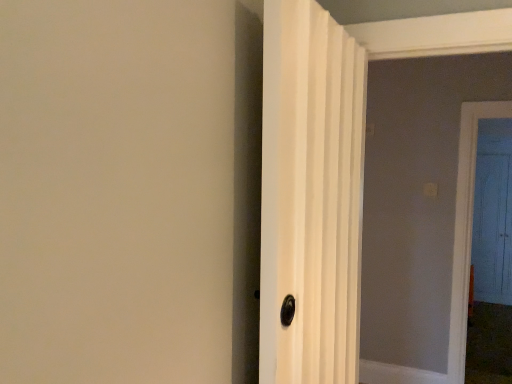
The width and height of the screenshot is (512, 384). What do you see at coordinates (311, 194) in the screenshot?
I see `white textured door at center, which ranks as the first door in left-to-right order` at bounding box center [311, 194].

Identify the location of white textured door at center, which ranks as the first door in left-to-right order. The height and width of the screenshot is (384, 512). (311, 194).

Identify the location of blue wooden door at right, which is the second door in front-to-back order. This screenshot has height=384, width=512. (493, 213).

What do you see at coordinates (493, 213) in the screenshot? I see `blue wooden door at right, marked as the first door in a back-to-front arrangement` at bounding box center [493, 213].

The width and height of the screenshot is (512, 384). What are the coordinates of `white textured door at center, which ranks as the first door in left-to-right order` in the screenshot? It's located at (311, 194).

Which object is positioned more to the left, blue wooden door at right, marked as the first door in a back-to-front arrangement, or white textured door at center, which is the second door from back to front?

white textured door at center, which is the second door from back to front, is more to the left.

Which object is closer to the camera taking this photo, blue wooden door at right, marked as the first door in a back-to-front arrangement, or white textured door at center, positioned as the 2th door in right-to-left order?

white textured door at center, positioned as the 2th door in right-to-left order, is closer to the camera.

Which is more distant, (508,250) or (323,270)?

The point (508,250) is farther from the camera.

From the image's perspective, is blue wooden door at right, which is counted as the 1th door, starting from the right, below white textured door at center, positioned as the 2th door in right-to-left order?

Yes.

From a real-world perspective, relative to white textured door at center, which is the second door from back to front, is blue wooden door at right, acting as the 2th door starting from the left, vertically above or below?

blue wooden door at right, acting as the 2th door starting from the left, is below white textured door at center, which is the second door from back to front.

Does blue wooden door at right, marked as the first door in a back-to-front arrangement, have a lesser width compared to white textured door at center, positioned as the 2th door in right-to-left order?

Correct, the width of blue wooden door at right, marked as the first door in a back-to-front arrangement, is less than that of white textured door at center, positioned as the 2th door in right-to-left order.

Is blue wooden door at right, which is counted as the 1th door, starting from the right, shorter than white textured door at center, which ranks as the first door in left-to-right order?

Incorrect, the height of blue wooden door at right, which is counted as the 1th door, starting from the right, does not fall short of that of white textured door at center, which ranks as the first door in left-to-right order.

Considering the relative sizes of blue wooden door at right, acting as the 2th door starting from the left, and white textured door at center, which is the second door from back to front, in the image provided, is blue wooden door at right, acting as the 2th door starting from the left, smaller than white textured door at center, which is the second door from back to front,?

Correct, blue wooden door at right, acting as the 2th door starting from the left, occupies less space than white textured door at center, which is the second door from back to front.

Is blue wooden door at right, which is counted as the 1th door, starting from the right, not within white textured door at center, positioned as the 2th door in right-to-left order?

Yes.

Is blue wooden door at right, which is counted as the 1th door, starting from the right, next to white textured door at center, positioned as the 2th door in right-to-left order, and touching it?

No.

Is blue wooden door at right, which is the second door in front-to-back order, aimed at white textured door at center, which ranks as the first door in front-to-back order?

No, blue wooden door at right, which is the second door in front-to-back order, is not facing towards white textured door at center, which ranks as the first door in front-to-back order.

How different are the orientations of blue wooden door at right, which is counted as the 1th door, starting from the right, and white textured door at center, which ranks as the first door in front-to-back order, in degrees?

They differ by 83.7 degrees in their facing directions.

Measure the distance between blue wooden door at right, which is the second door in front-to-back order, and white textured door at center, which is the second door from back to front.

blue wooden door at right, which is the second door in front-to-back order, is 4.65 meters away from white textured door at center, which is the second door from back to front.

The width and height of the screenshot is (512, 384). Find the location of `door below the white textured door at center, which ranks as the first door in left-to-right order (from a real-world perspective)`. door below the white textured door at center, which ranks as the first door in left-to-right order (from a real-world perspective) is located at coordinates (493, 213).

Does white textured door at center, which ranks as the first door in left-to-right order, appear on the right side of blue wooden door at right, which is the second door in front-to-back order?

Incorrect, white textured door at center, which ranks as the first door in left-to-right order, is not on the right side of blue wooden door at right, which is the second door in front-to-back order.

Which object is further away from the camera taking this photo, white textured door at center, which is the second door from back to front, or blue wooden door at right, acting as the 2th door starting from the left?

blue wooden door at right, acting as the 2th door starting from the left, is further away from the camera.

Considering the points (313, 362) and (496, 227), which point is behind, point (313, 362) or point (496, 227)?

The point (496, 227) is more distant.

From the image's perspective, which one is positioned higher, white textured door at center, which ranks as the first door in left-to-right order, or blue wooden door at right, marked as the first door in a back-to-front arrangement?

white textured door at center, which ranks as the first door in left-to-right order, from the image's perspective.

From a real-world perspective, is white textured door at center, which ranks as the first door in front-to-back order, located beneath blue wooden door at right, which is the second door in front-to-back order?

Incorrect, from a real-world perspective, white textured door at center, which ranks as the first door in front-to-back order, is higher than blue wooden door at right, which is the second door in front-to-back order.

Is white textured door at center, which ranks as the first door in front-to-back order, wider or thinner than blue wooden door at right, which is counted as the 1th door, starting from the right?

Considering their sizes, white textured door at center, which ranks as the first door in front-to-back order, looks broader than blue wooden door at right, which is counted as the 1th door, starting from the right.

Does white textured door at center, positioned as the 2th door in right-to-left order, have a lesser height compared to blue wooden door at right, which is counted as the 1th door, starting from the right?

Correct, white textured door at center, positioned as the 2th door in right-to-left order, is not as tall as blue wooden door at right, which is counted as the 1th door, starting from the right.

Can you confirm if white textured door at center, which ranks as the first door in left-to-right order, is bigger than blue wooden door at right, which is the second door in front-to-back order?

Yes, white textured door at center, which ranks as the first door in left-to-right order, is bigger than blue wooden door at right, which is the second door in front-to-back order.

From the picture: Is white textured door at center, which ranks as the first door in front-to-back order, outside of blue wooden door at right, acting as the 2th door starting from the left?

Yes, white textured door at center, which ranks as the first door in front-to-back order, is located beyond the bounds of blue wooden door at right, acting as the 2th door starting from the left.

Are white textured door at center, which ranks as the first door in left-to-right order, and blue wooden door at right, acting as the 2th door starting from the left, beside each other?

No, white textured door at center, which ranks as the first door in left-to-right order, is not making contact with blue wooden door at right, acting as the 2th door starting from the left.

Based on the photo, is white textured door at center, positioned as the 2th door in right-to-left order, facing towards blue wooden door at right, marked as the first door in a back-to-front arrangement?

No.

Locate an element on the screen. This screenshot has width=512, height=384. door in front of the blue wooden door at right, marked as the first door in a back-to-front arrangement is located at coordinates (311, 194).

Locate an element on the screen. The width and height of the screenshot is (512, 384). door above the blue wooden door at right, acting as the 2th door starting from the left (from the image's perspective) is located at coordinates (311, 194).

The height and width of the screenshot is (384, 512). I want to click on door located in front of the blue wooden door at right, marked as the first door in a back-to-front arrangement, so click(x=311, y=194).